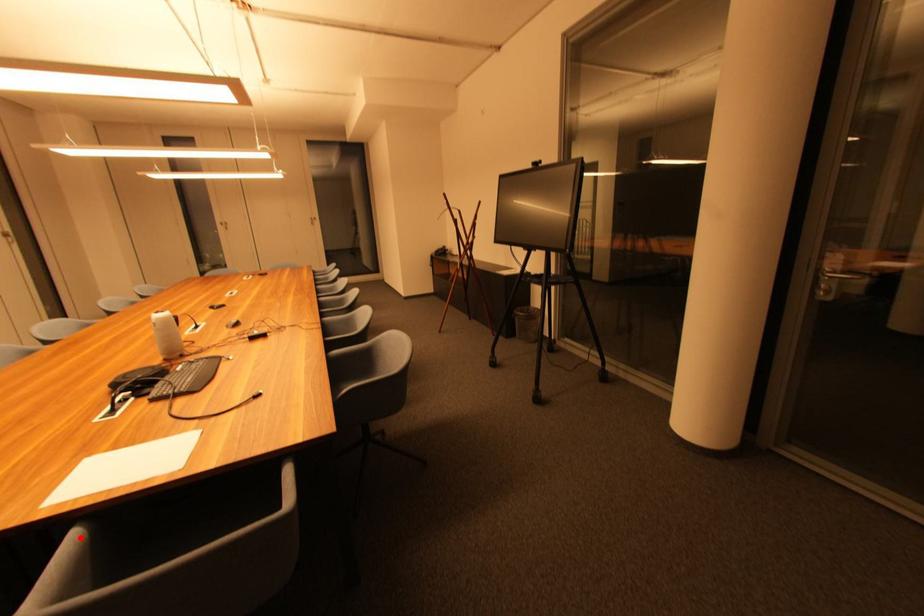
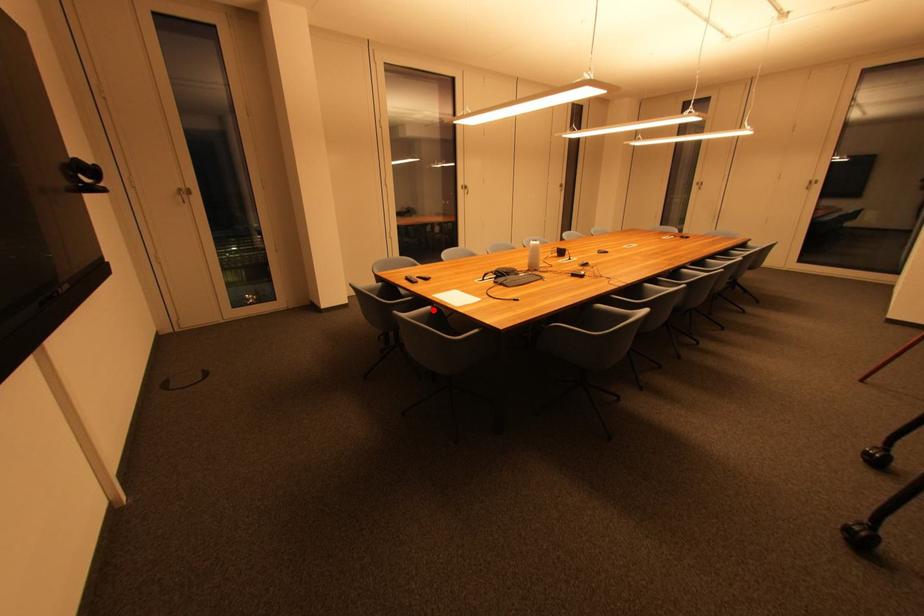
I am providing you with two images of the same scene from different viewpoints. A red point is marked on the first image and another point is marked on the second image. Are the points marked in image1 and image2 representing the same 3D position?

Yes